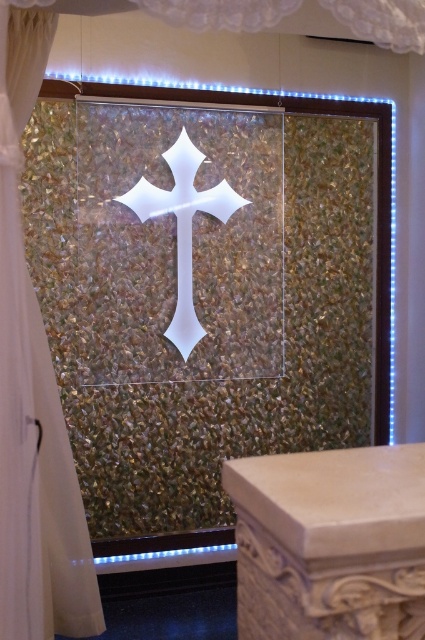
Is white sheer curtain at center wider than white glossy cross at center?

In fact, white sheer curtain at center might be narrower than white glossy cross at center.

Who is higher up, white sheer curtain at center or white glossy cross at center?

white glossy cross at center is higher up.

Find the location of `white sheer curtain at center`. white sheer curtain at center is located at coordinates (33, 397).

Which is behind, point (414, 522) or point (20, 369)?

Positioned behind is point (20, 369).

Is point (241, 550) positioned after point (56, 628)?

No, it is in front of (56, 628).

This screenshot has width=425, height=640. What do you see at coordinates (329, 544) in the screenshot?
I see `beige stone column at lower right` at bounding box center [329, 544].

This screenshot has width=425, height=640. I want to click on beige stone column at lower right, so click(329, 544).

Does beige stone column at lower right have a greater height compared to white glossy cross at center?

Incorrect, beige stone column at lower right's height is not larger of white glossy cross at center's.

Between beige stone column at lower right and white glossy cross at center, which one has less height?

beige stone column at lower right

You are a GUI agent. You are given a task and a screenshot of the screen. Output one action in this format:
    pyautogui.click(x=<x>, y=<y>)
    Task: Click on the beige stone column at lower right
    
    Given the screenshot: What is the action you would take?
    pyautogui.click(x=329, y=544)

At what (x,y) coordinates should I click in order to perform the action: click on beige stone column at lower right. Please return your answer as a coordinate pair (x, y). The image size is (425, 640). Looking at the image, I should click on (329, 544).